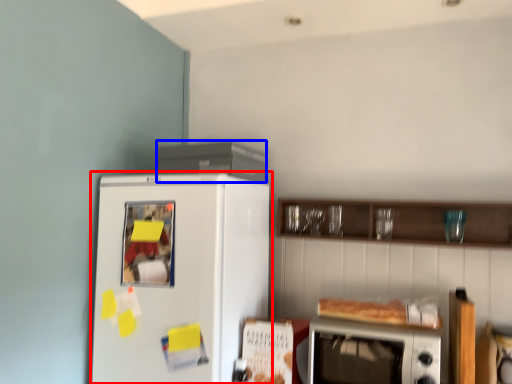
Question: Which of the following is the farthest to the observer, refrigerator (highlighted by a red box) or appliance (highlighted by a blue box)?

Choices:
 (A) refrigerator
 (B) appliance

Answer: (B)